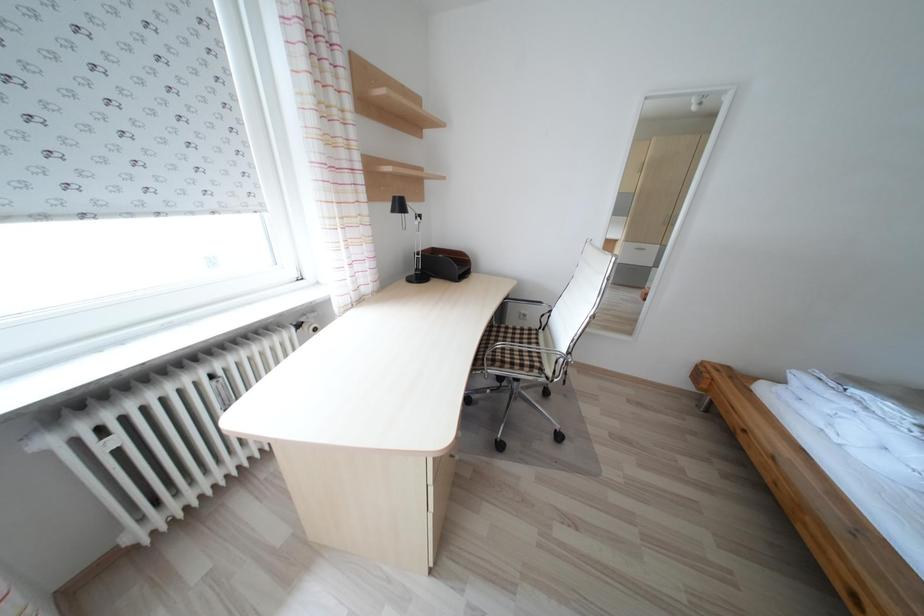
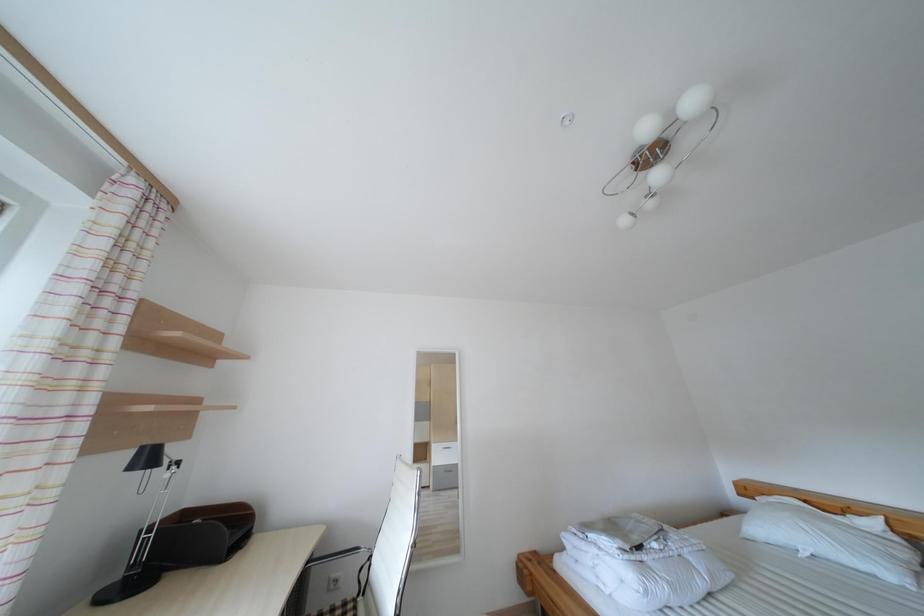
The images are taken continuously from a first-person perspective. In which direction is your viewpoint rotating?

The camera rotated toward right-up.